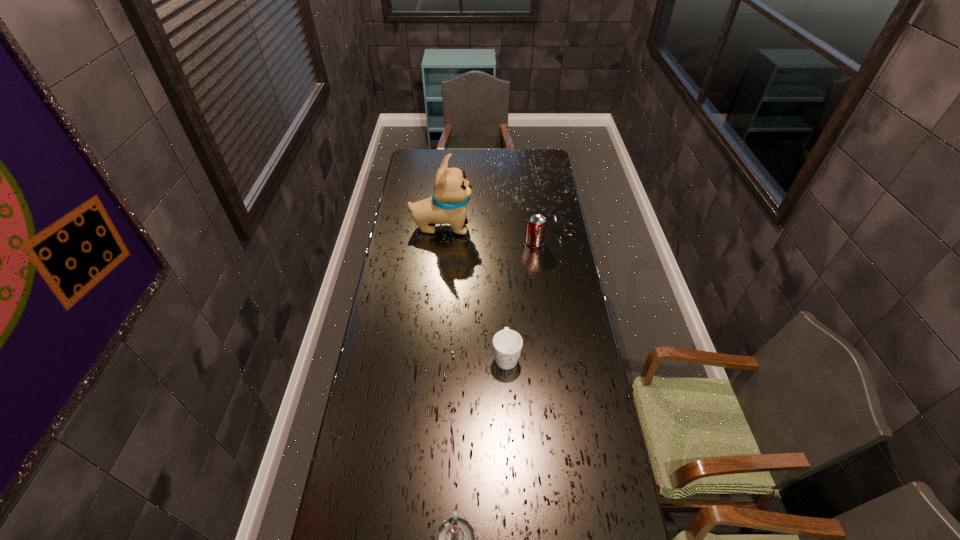
Identify which object is located as the second nearest to the rightmost object. Please provide its 2D coordinates. Your answer should be formatted as a tuple, i.e. [(x, y)], where the tuple contains the x and y coordinates of a point satisfying the conditions above.

[(507, 344)]

Locate which object is the second closest to the candle. Please provide its 2D coordinates. Your answer should be formatted as a tuple, i.e. [(x, y)], where the tuple contains the x and y coordinates of a point satisfying the conditions above.

[(537, 225)]

Find the location of a particular element. The image size is (960, 540). vacant space that satisfies the following two spatial constraints: 1. on the face of the tallest object; 2. on the back side of the soda can is located at coordinates (441, 243).

Identify the location of free space that satisfies the following two spatial constraints: 1. on the back side of the soda can; 2. on the face of the tallest object. (533, 226).